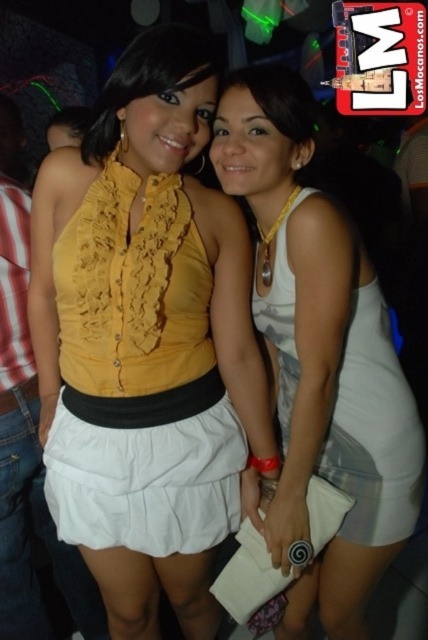
You are a fashion designer observing two women at a party. You notice the yellow ruffled blouse at center and the matte yellow blouse at center. Which of these two blouses appears taller when viewed from the front?

The yellow ruffled blouse at center appears taller than the matte yellow blouse at center because it has a greater height as described.

Based on the photo, based on the scene description, where is the white cotton skirt at center located in terms of coordinates?

The white cotton skirt at center is located at coordinates point (145, 481).